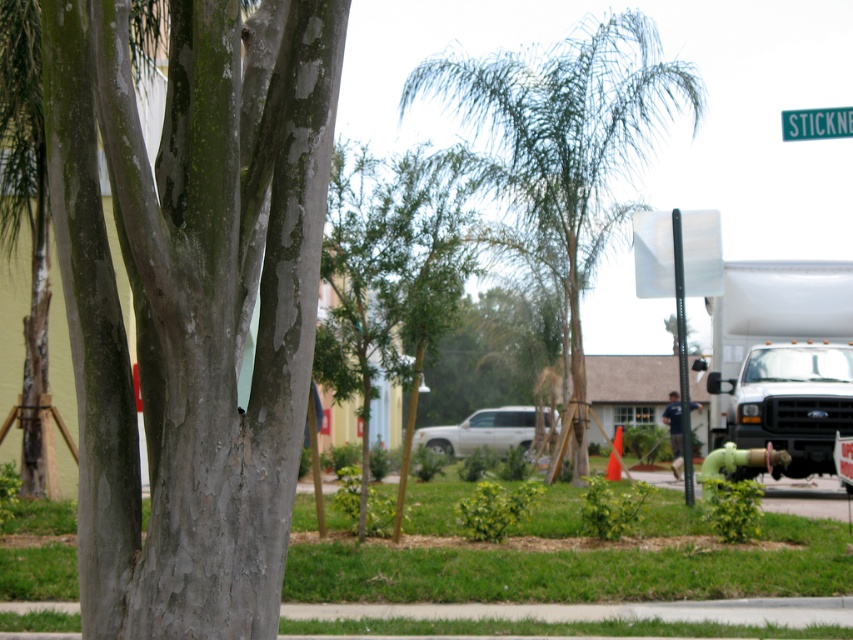
Which is behind, point (741, 419) or point (621, 440)?

The point (621, 440) is behind.

Is white matte truck at right further to camera compared to orange matte traffic cone at center?

Yes, it is.

The width and height of the screenshot is (853, 640). In order to click on white matte truck at right in this screenshot , I will do `click(788, 403)`.

Is green leafy palm tree at center bigger than green plastic sign at upper right?

Actually, green leafy palm tree at center might be smaller than green plastic sign at upper right.

Is green leafy palm tree at center above green plastic sign at upper right?

Indeed, green leafy palm tree at center is positioned over green plastic sign at upper right.

Looking at this image, who is more distant from viewer, (468, 68) or (840, 116)?

The point (468, 68) is behind.

Locate an element on the screen. Image resolution: width=853 pixels, height=640 pixels. green leafy palm tree at center is located at coordinates (566, 145).

Which is more to the right, black metal pole at upper right or green plastic sign at upper right?

black metal pole at upper right is more to the right.

Between point (675, 236) and point (825, 116), which one is positioned behind?

The point (675, 236) is behind.

At what (x,y) coordinates should I click in order to perform the action: click on black metal pole at upper right. Please return your answer as a coordinate pair (x, y). Image resolution: width=853 pixels, height=640 pixels. Looking at the image, I should click on (682, 356).

I want to click on black metal pole at upper right, so click(x=682, y=356).